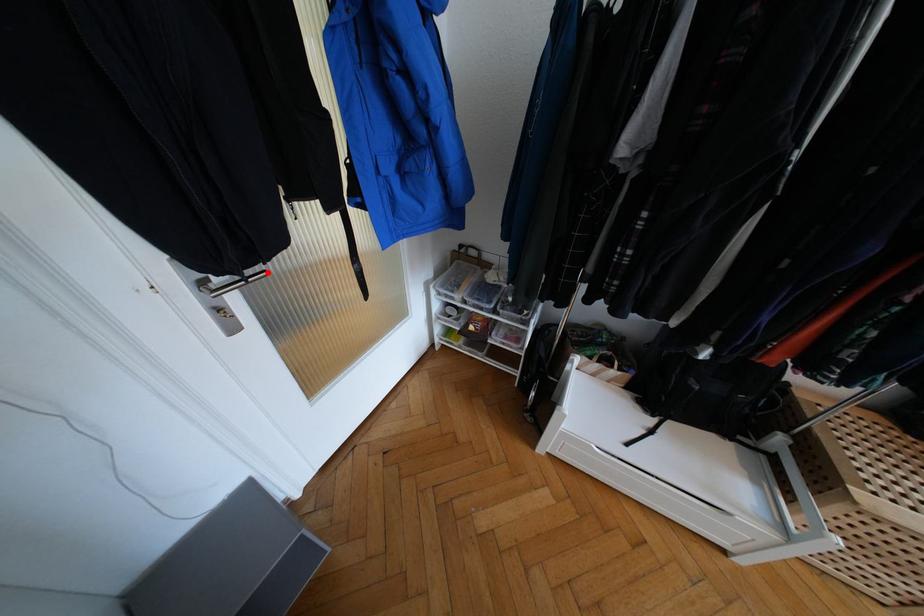
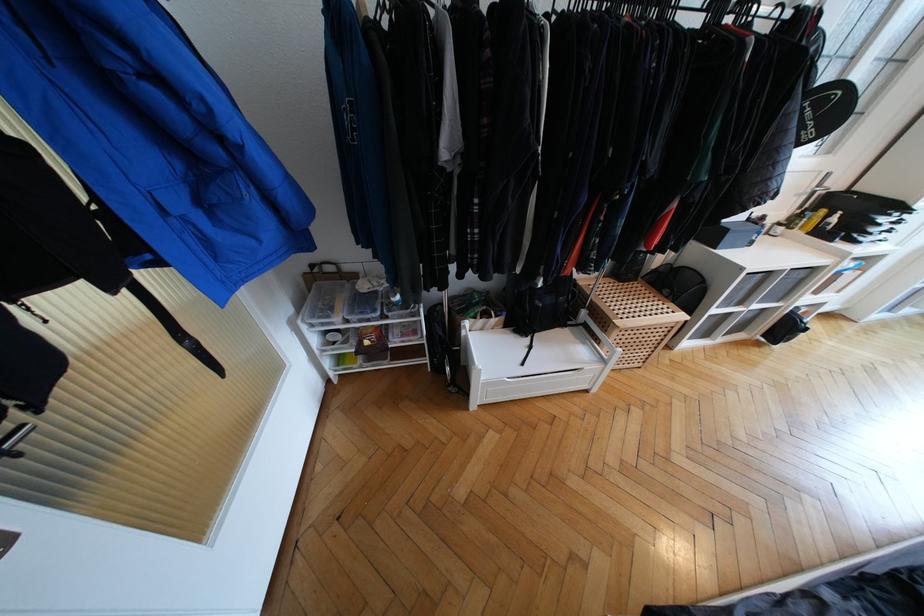
Question: I am providing you with two images of the same scene from different viewpoints. Image1 has a red point marked. In image2, the corresponding 3D location appears at what relative position? Reply with the corresponding letter.

Choices:
 (A) Closer
 (B) Farther

Answer: (B)